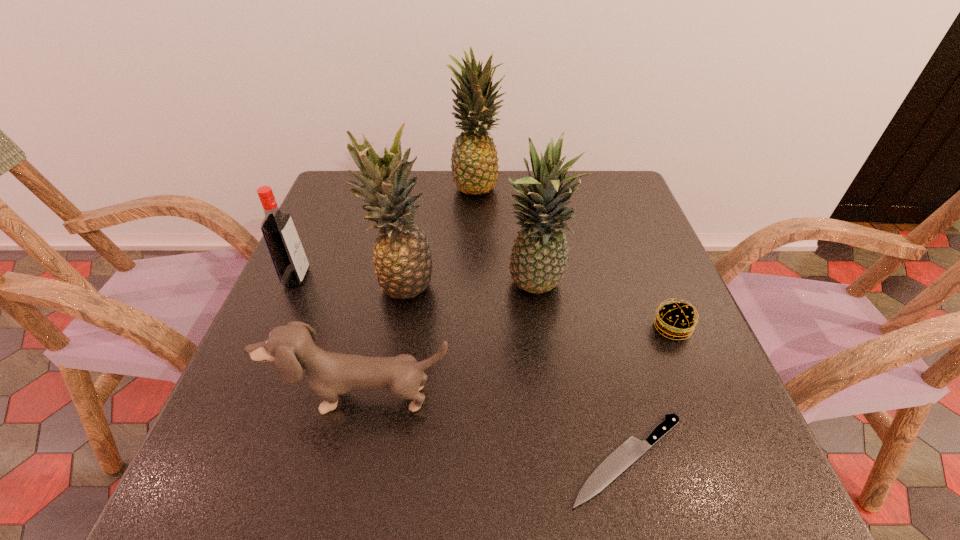
Where is `the farthest object`? the farthest object is located at coordinates (474, 167).

This screenshot has width=960, height=540. In order to click on the leftmost pineapple in this screenshot , I will do `click(402, 258)`.

The width and height of the screenshot is (960, 540). In order to click on the leftmost object in this screenshot , I will do `click(285, 248)`.

Identify the location of the fourth shortest object. The height and width of the screenshot is (540, 960). (285, 248).

Locate an element on the screen. puppy is located at coordinates (329, 374).

The width and height of the screenshot is (960, 540). I want to click on the rightmost object, so click(x=675, y=320).

The height and width of the screenshot is (540, 960). I want to click on the fifth farthest object, so click(675, 320).

Identify the location of the shortest object. (627, 453).

You are a GUI agent. You are given a task and a screenshot of the screen. Output one action in this format:
    pyautogui.click(x=<x>, y=<y>)
    Task: Click on the vacant space located on the right of the farthest object
    This screenshot has height=540, width=960.
    Given the screenshot: What is the action you would take?
    pyautogui.click(x=601, y=185)

Image resolution: width=960 pixels, height=540 pixels. I want to click on vacant space positioned on the back of the leftmost pineapple, so pyautogui.click(x=422, y=186).